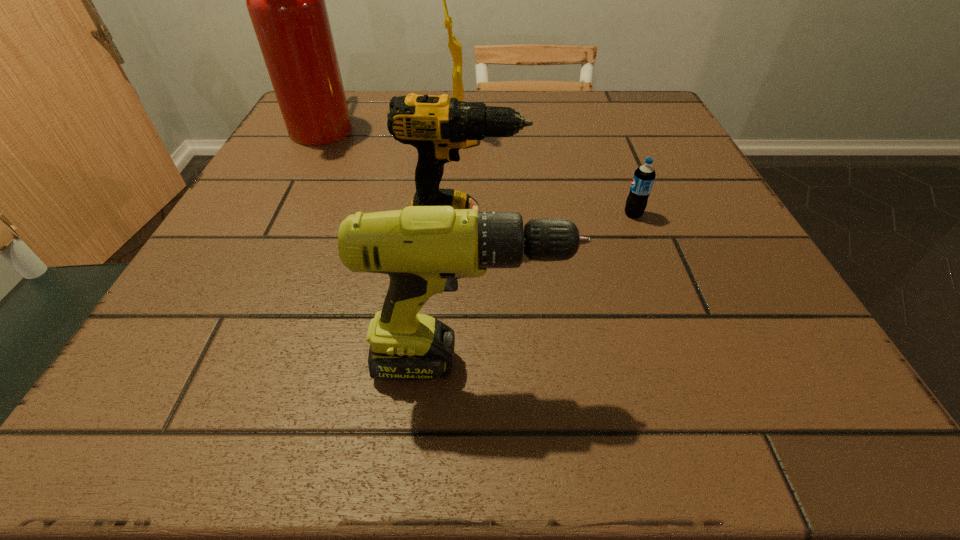
You are a GUI agent. You are given a task and a screenshot of the screen. Output one action in this format:
    pyautogui.click(x=<x>, y=<y>)
    Task: Click on the free spot located at the tip of the farther drill
    
    Given the screenshot: What is the action you would take?
    pyautogui.click(x=571, y=231)

Where is `vacant region located on the left of the rightmost object`? This screenshot has height=540, width=960. vacant region located on the left of the rightmost object is located at coordinates (448, 214).

The width and height of the screenshot is (960, 540). Find the location of `fire extinguisher that is positioned at the far edge`. fire extinguisher that is positioned at the far edge is located at coordinates (285, 0).

Find the location of a particular element. This screenshot has width=960, height=540. award located at the far edge is located at coordinates (455, 47).

You are a GUI agent. You are given a task and a screenshot of the screen. Output one action in this format:
    pyautogui.click(x=<x>, y=<y>)
    Task: Click on the object that is at the near edge
    The height and width of the screenshot is (540, 960).
    Given the screenshot: What is the action you would take?
    pyautogui.click(x=424, y=249)

At what (x,y) coordinates should I click in order to perform the action: click on object located in the left edge section of the desktop. Please return your answer as a coordinate pair (x, y). Looking at the image, I should click on (285, 0).

The image size is (960, 540). I want to click on object situated at the right edge, so click(x=644, y=176).

Find the location of a particular element. This screenshot has height=540, width=960. object situated at the far left corner is located at coordinates tap(285, 0).

This screenshot has height=540, width=960. I want to click on vacant space at the far edge of the desktop, so click(x=553, y=106).

This screenshot has width=960, height=540. I want to click on vacant space at the near edge, so click(x=568, y=391).